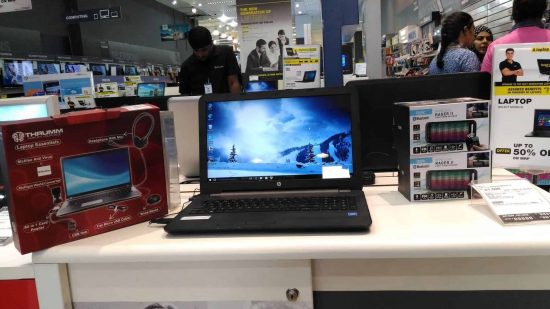
This screenshot has height=309, width=550. Find the location of `black laptop`. black laptop is located at coordinates (276, 220).